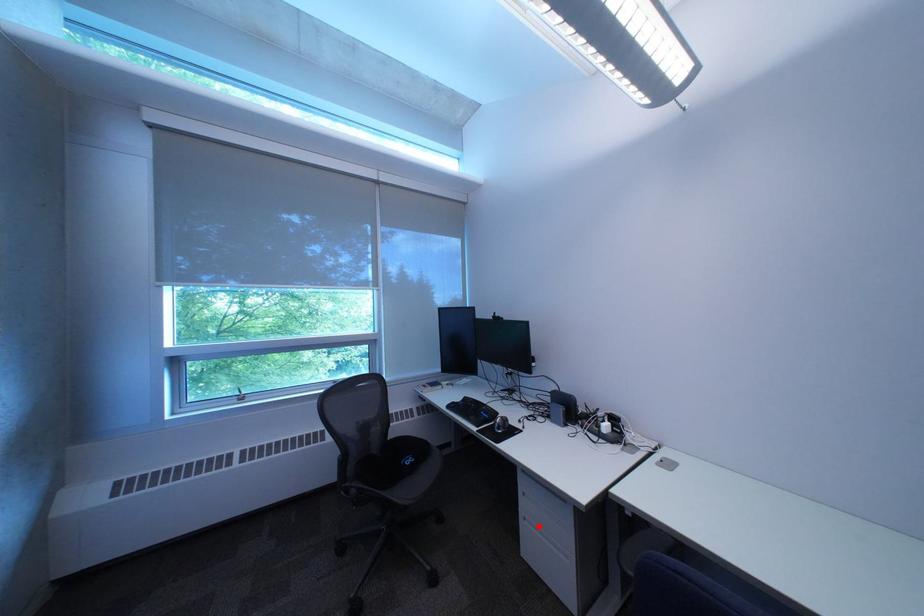
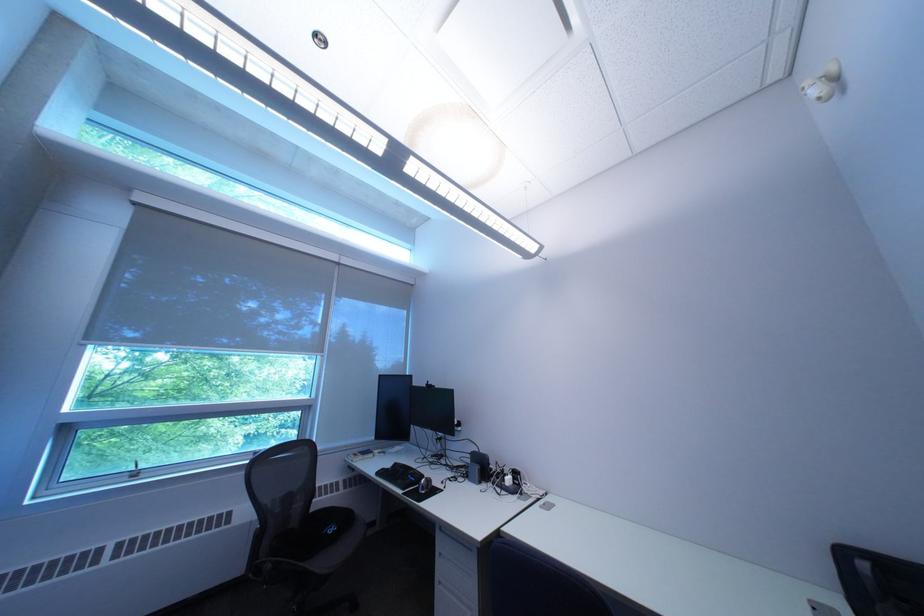
Where in the second image is the point corresponding to the highlighted location from the first image?

(454, 592)